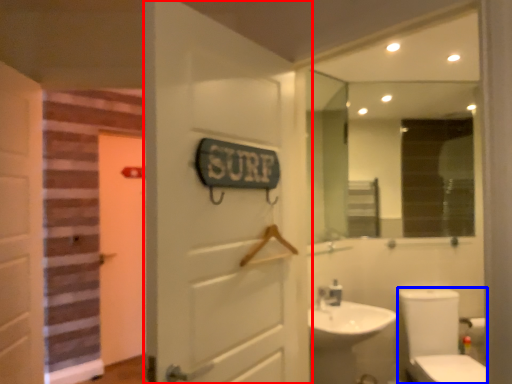
Question: Which object appears farthest to the camera in this image, door (highlighted by a red box) or toilet bowl (highlighted by a blue box)?

Choices:
 (A) door
 (B) toilet bowl

Answer: (B)